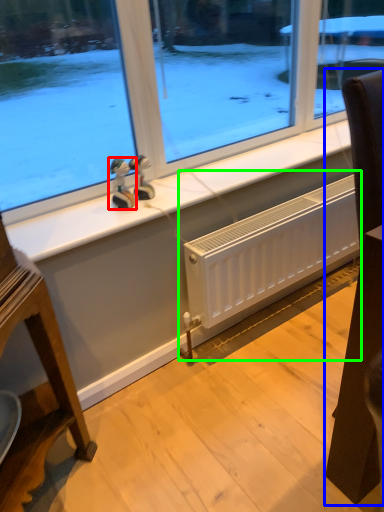
Question: Based on their relative distances, which object is nearer to figurine (highlighted by a red box)? Choose from furniture (highlighted by a blue box) and radiator (highlighted by a green box).

Choices:
 (A) furniture
 (B) radiator

Answer: (B)